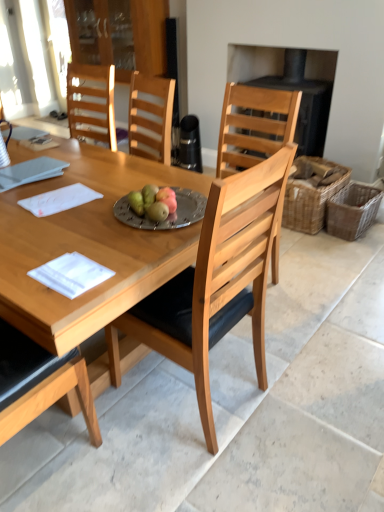
At what (x,y) coordinates should I click in order to perform the action: click on free space above white paper at center, which ranks as the second notepad in bottom-to-top order (from a real-world perspective). Please return your answer as a coordinate pair (x, y). The width and height of the screenshot is (384, 512). Looking at the image, I should click on (58, 195).